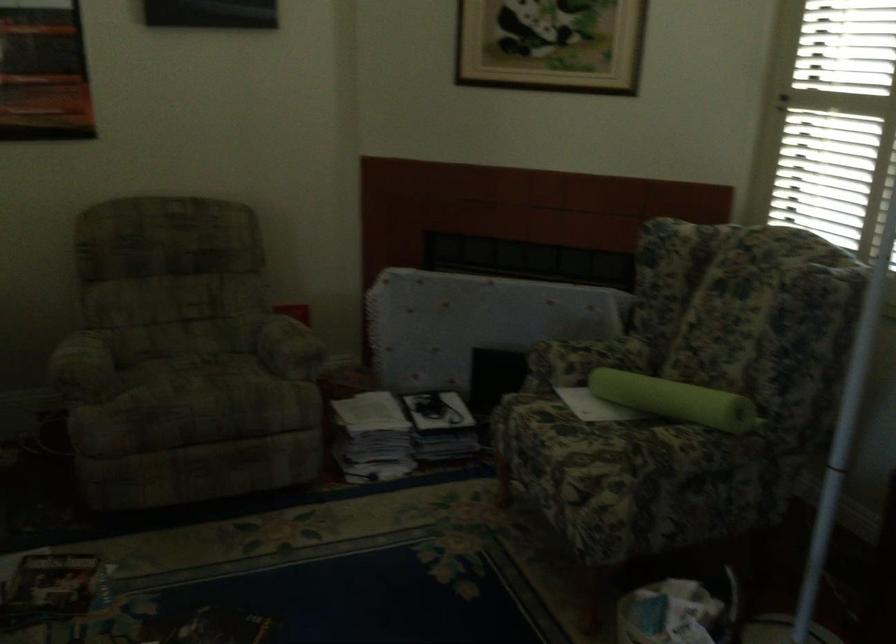
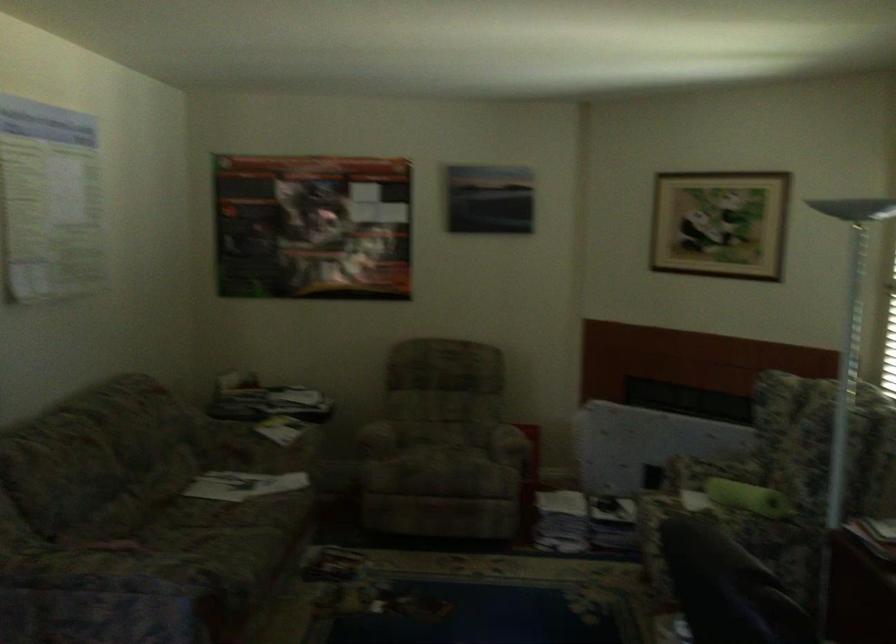
Locate, in the second image, the point that corresponds to [701,413] in the first image.

(748, 498)